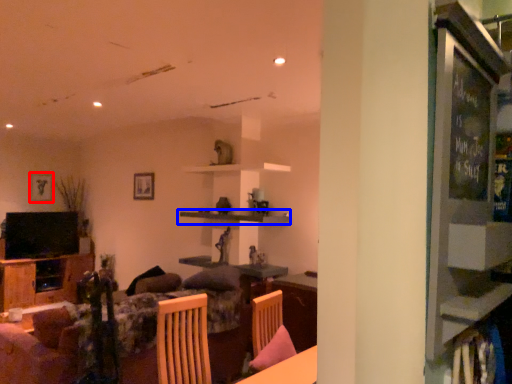
Question: Which object appears farthest to the camera in this image, picture frame (highlighted by a red box) or shelf (highlighted by a blue box)?

Choices:
 (A) picture frame
 (B) shelf

Answer: (A)